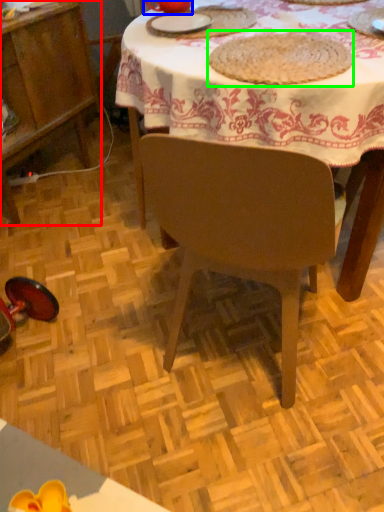
Question: Which object is the farthest from cabinetry (highlighted by a red box)? Choose among these: tableware (highlighted by a blue box) or food (highlighted by a green box).

Choices:
 (A) tableware
 (B) food

Answer: (B)